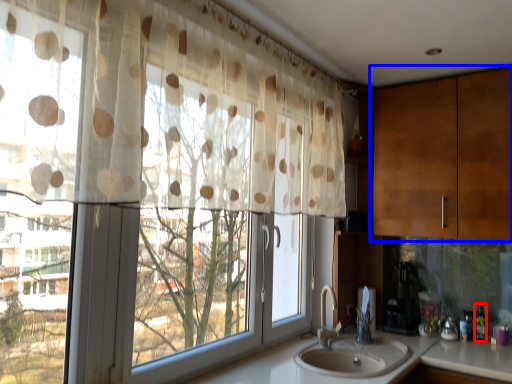
Question: Which object is closer to the camera taking this photo, bottle (highlighted by a red box) or cabinetry (highlighted by a blue box)?

Choices:
 (A) bottle
 (B) cabinetry

Answer: (B)